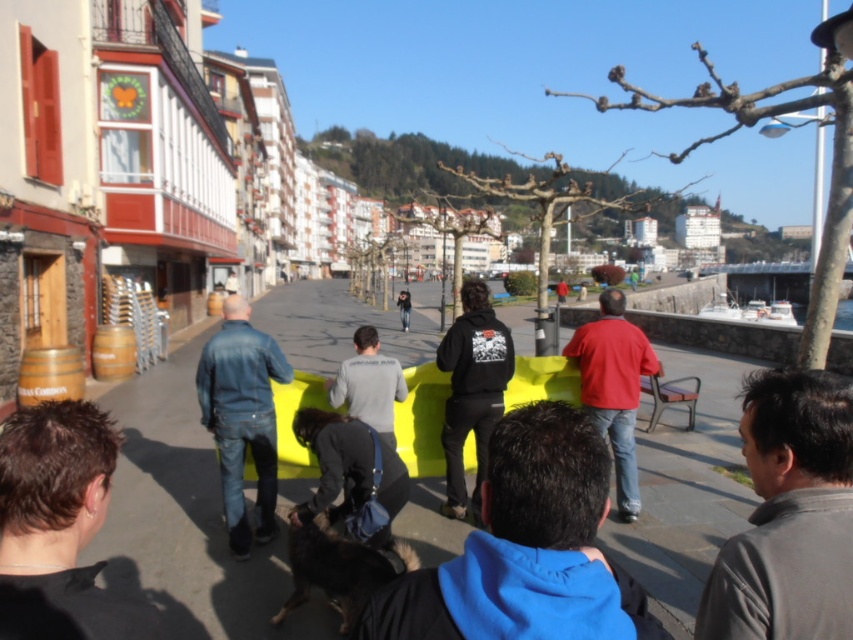
Question: Is the position of blue fleece jacket at center less distant than that of metallic brown chair at right?

Choices:
 (A) no
 (B) yes

Answer: (B)

Question: Can you confirm if dark brown hair at lower left is thinner than metallic brown chair at right?

Choices:
 (A) yes
 (B) no

Answer: (A)

Question: Which of these objects is positioned farthest from the gray matte shirt at lower right?

Choices:
 (A) red matte shirt at center
 (B) gray cotton hoodie at center
 (C) denim jacket at left

Answer: (C)

Question: Among these objects, which one is farthest from the camera?

Choices:
 (A) red matte shirt at center
 (B) black matte hoodie at center

Answer: (B)

Question: Does dark brown hair at lower left appear under dark gray fleece sweatshirt at center?

Choices:
 (A) no
 (B) yes

Answer: (B)

Question: Which point is farther to the camera?

Choices:
 (A) yellow plastic bench at center
 (B) denim sweatshirt at center
 (C) matte red sweatshirt at center

Answer: (C)